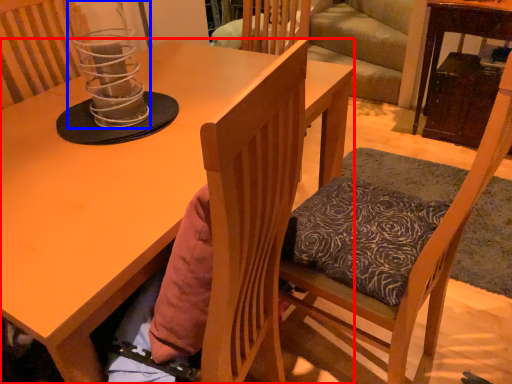
Question: Which object appears closest to the camera in this image, desk (highlighted by a red box) or candle holder (highlighted by a blue box)?

Choices:
 (A) desk
 (B) candle holder

Answer: (A)